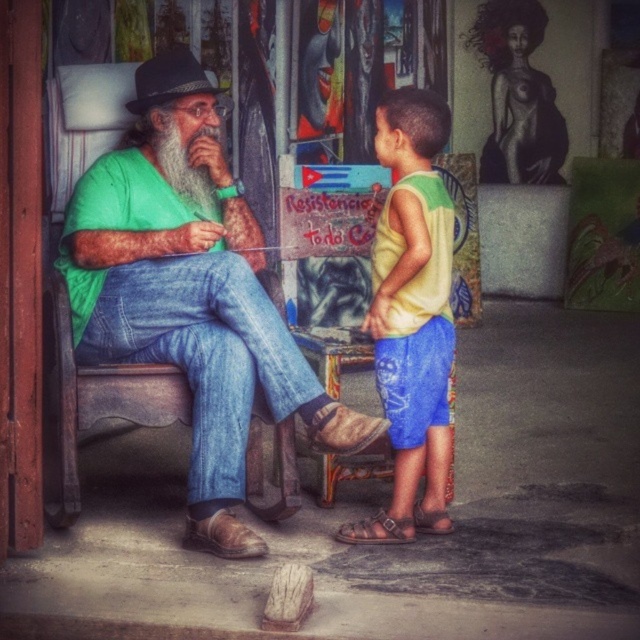
You are a photographer positioned 2.5 meters away from the green matte shirt at left. Can you capture the entire scene without moving closer?

The green matte shirt at left is 3.02 meters away from the camera. Since you are positioned 2.5 meters away from it, you are closer than the shirt, so you can capture the entire scene without moving closer.